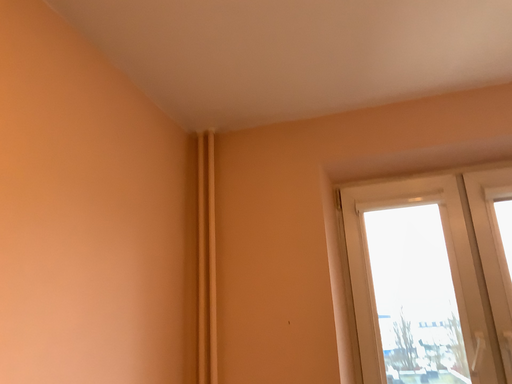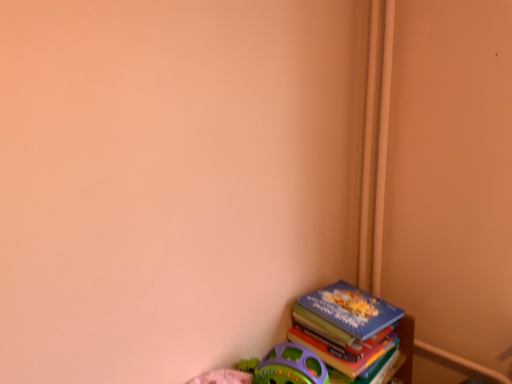
Question: Which way did the camera rotate in the video?

Choices:
 (A) rotated right
 (B) rotated left

Answer: (B)